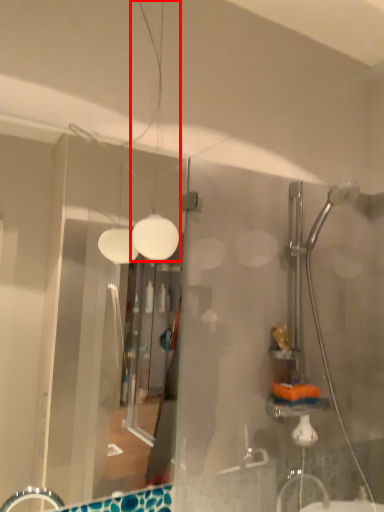
Question: From the image's perspective, where is light fixture (annotated by the red box) located relative to glass door?

Choices:
 (A) below
 (B) above

Answer: (B)